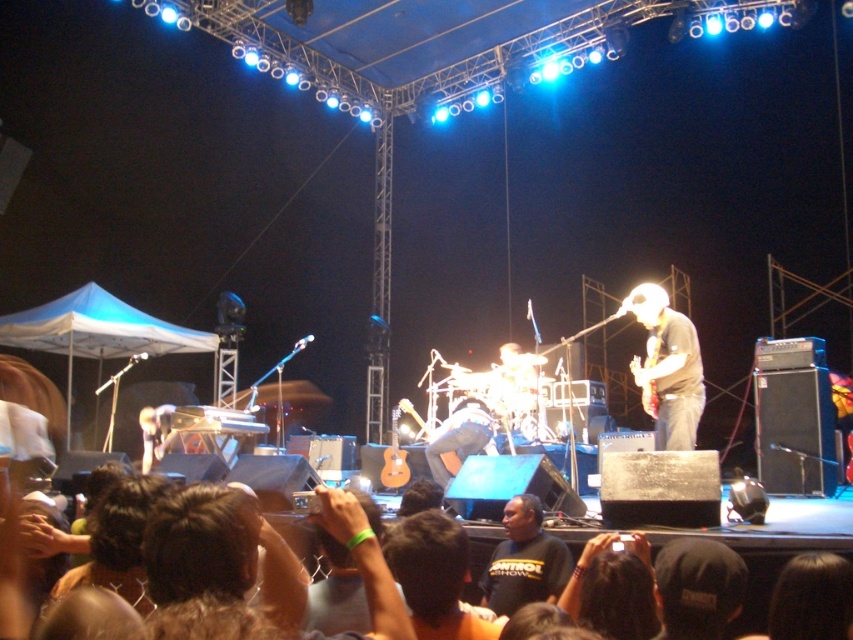
Question: Among these objects, which one is farthest from the camera?

Choices:
 (A) matte black guitar at center
 (B) black cotton shirt at center

Answer: (A)

Question: Can you confirm if matte black guitar at center is positioned below black cotton shirt at center?

Choices:
 (A) no
 (B) yes

Answer: (A)

Question: Among these points, which one is nearest to the camera?

Choices:
 (A) (496, 548)
 (B) (635, 298)

Answer: (A)

Question: Can you confirm if matte black guitar at center is wider than black cotton shirt at center?

Choices:
 (A) no
 (B) yes

Answer: (B)

Question: Does matte black guitar at center have a larger size compared to black cotton shirt at center?

Choices:
 (A) no
 (B) yes

Answer: (B)